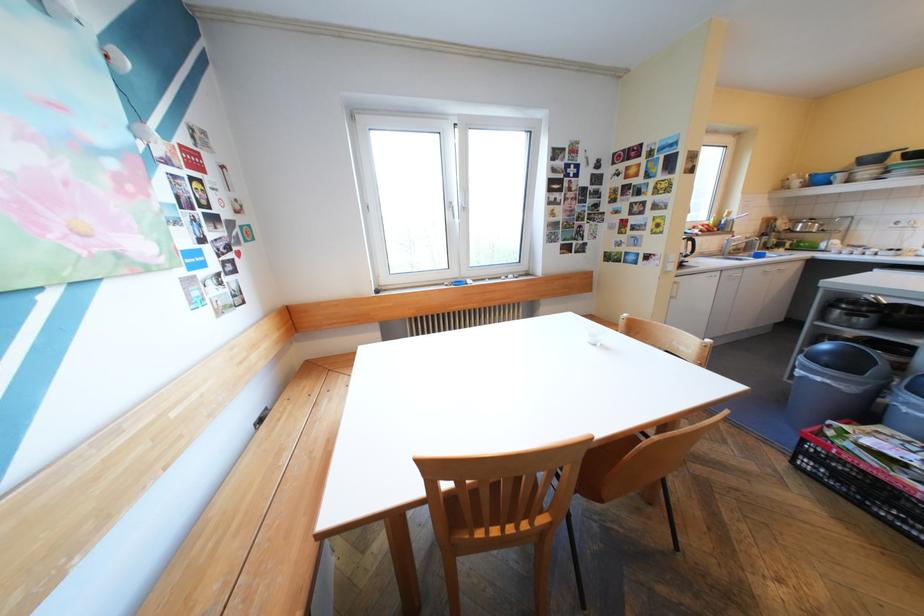
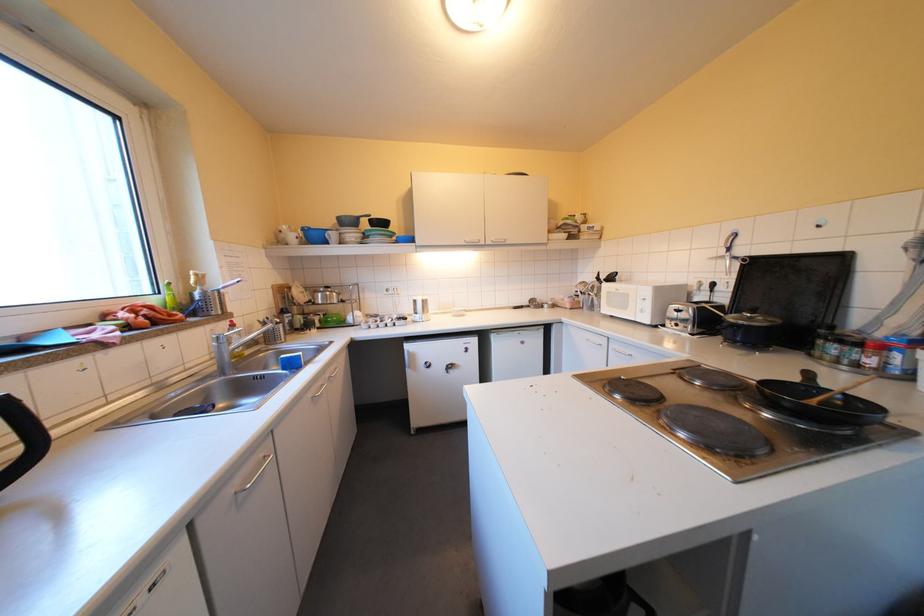
Locate, in the second image, the point that corresponds to point 825,248 in the first image.

(356, 323)